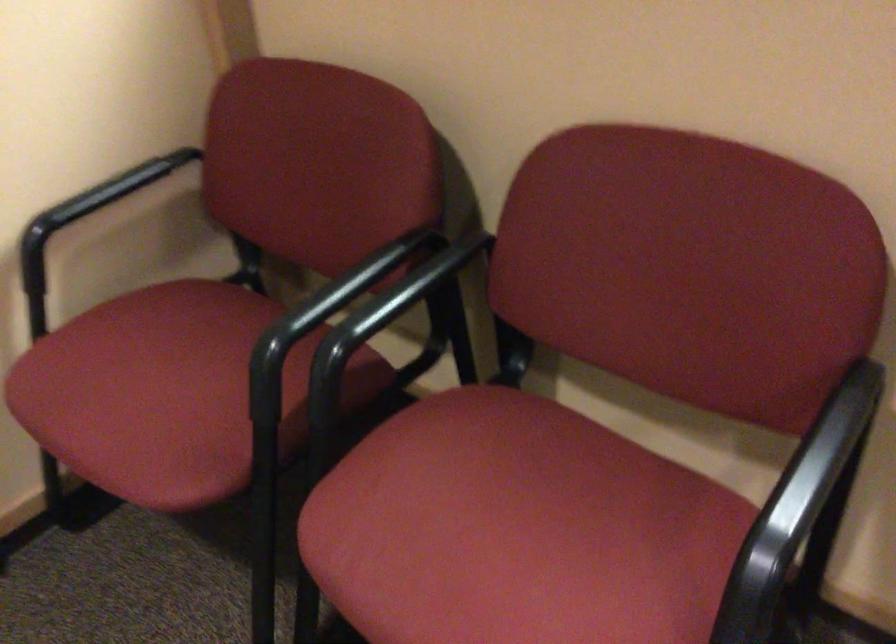
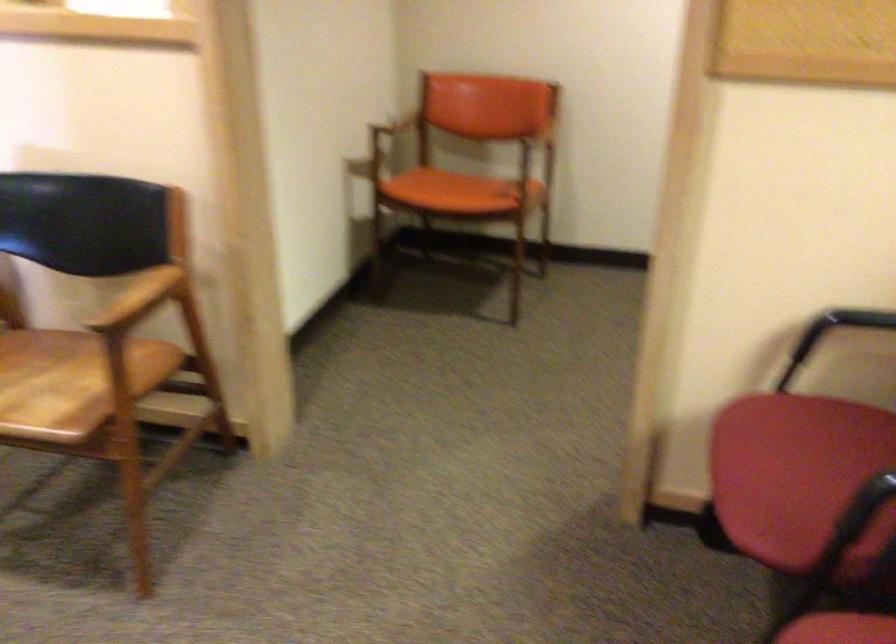
In the second image, find the point that corresponds to the point at 69,230 in the first image.

(840, 325)